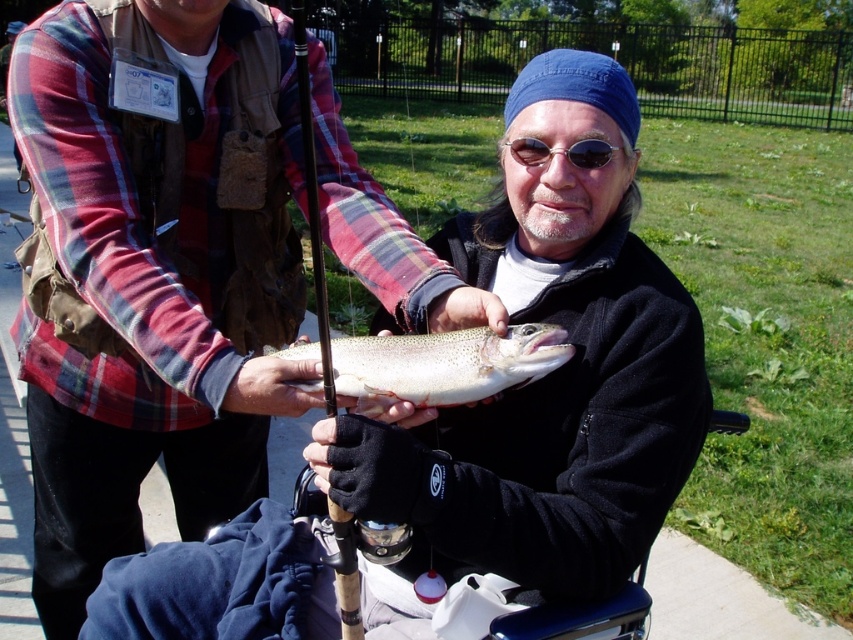
You are a photographer trying to capture a closeup of the shiny silver fish at center and the wooden fishing pole at center. Since you want both objects to appear the same size in the photo, which object should you move closer to the camera?

The shiny silver fish at center is thinner than wooden fishing pole at center, so you should move the wooden fishing pole at center closer to the camera to make them appear the same size in the photo.

You are a wildlife photographer aiming to capture a closeup of the shiny silver fish at center and the wooden fishing pole at center in the same frame. Given that your camera has a maximum focus range of 25 inches, can you achieve this without moving either object?

The shiny silver fish at center is 26.44 inches from the wooden fishing pole at center. Since the distance exceeds the camera maximum focus range of 25 inches, you cannot capture both in the same frame without moving either object.